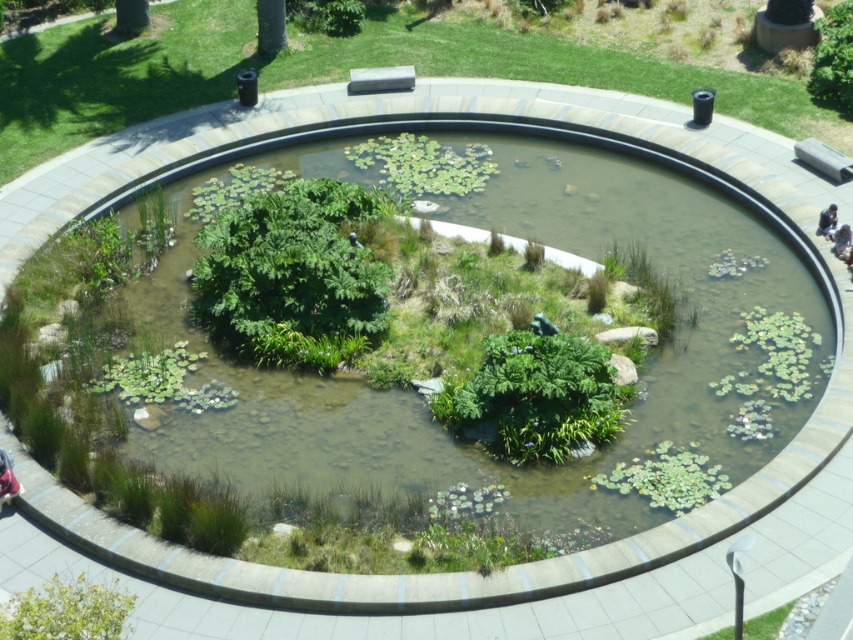
Does green leafy tree at upper center appear on the left side of green leafy tree at upper left?

Incorrect, green leafy tree at upper center is not on the left side of green leafy tree at upper left.

Which of these two, green leafy tree at upper center or green leafy tree at upper left, stands taller?

green leafy tree at upper center

This screenshot has width=853, height=640. What do you see at coordinates (270, 26) in the screenshot?
I see `green leafy tree at upper center` at bounding box center [270, 26].

Find the location of a particular element. This screenshot has height=640, width=853. green leafy tree at upper center is located at coordinates 270,26.

Can you confirm if green leafy tree at upper center is thinner than light brown wooden bench at lower right?

In fact, green leafy tree at upper center might be wider than light brown wooden bench at lower right.

Who is more forward, (262, 20) or (834, 236)?

Point (834, 236) is more forward.

Between point (283, 24) and point (846, 228), which one is positioned in front?

Positioned in front is point (846, 228).

This screenshot has height=640, width=853. In order to click on green leafy tree at upper center in this screenshot , I will do `click(270, 26)`.

Image resolution: width=853 pixels, height=640 pixels. What do you see at coordinates (500, 332) in the screenshot?
I see `green leafy pond at center` at bounding box center [500, 332].

Can you confirm if green leafy pond at center is bigger than fluffy pink jacket at bottom left?

Correct, green leafy pond at center is larger in size than fluffy pink jacket at bottom left.

Does point (672, 241) come farther from viewer compared to point (0, 497)?

Yes, point (672, 241) is behind point (0, 497).

This screenshot has width=853, height=640. Find the location of `green leafy pond at center`. green leafy pond at center is located at coordinates (500, 332).